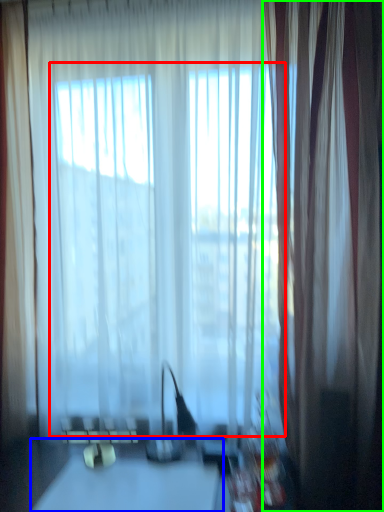
Question: Which object is positioned closest to bay window (highlighted by a red box)? Select from table (highlighted by a blue box) and curtain (highlighted by a green box).

Choices:
 (A) table
 (B) curtain

Answer: (B)